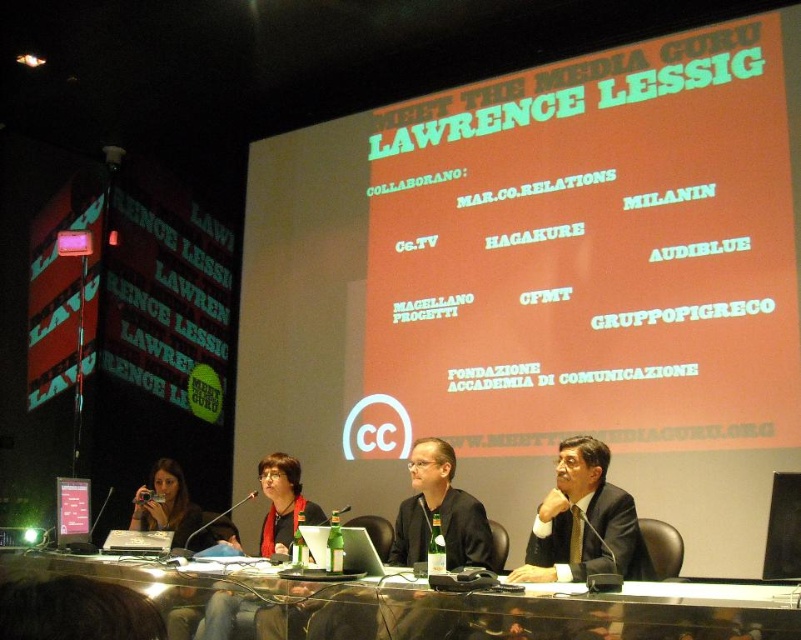
Question: Which is nearer to the black suit at center?

Choices:
 (A) matte black jacket at center
 (B) transparent glass table at center
 (C) matte black camera at lower left
 (D) metallic silver laptop at center

Answer: (B)

Question: Estimate the real-world distances between objects in this image. Which object is farther from the black suit at center?

Choices:
 (A) metallic silver laptop at center
 (B) silver metallic laptop at center
 (C) matte black jacket at center
 (D) transparent glass table at center

Answer: (A)

Question: Does matte black jacket at center have a greater width compared to metallic silver laptop at center?

Choices:
 (A) no
 (B) yes

Answer: (B)

Question: Among these objects, which one is nearest to the camera?

Choices:
 (A) metallic silver laptop at center
 (B) silver metallic laptop at center

Answer: (B)

Question: Can you confirm if matte black suit at center is positioned below metallic silver laptop at center?

Choices:
 (A) no
 (B) yes

Answer: (A)

Question: Does matte black suit at center appear on the right side of matte black jacket at center?

Choices:
 (A) yes
 (B) no

Answer: (A)